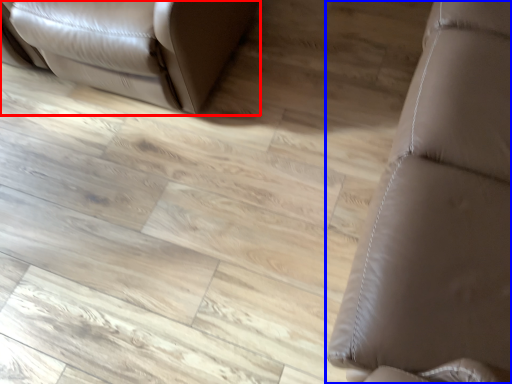
Question: Among these objects, which one is nearest to the camera, furniture (highlighted by a red box) or furniture (highlighted by a blue box)?

Choices:
 (A) furniture
 (B) furniture

Answer: (B)